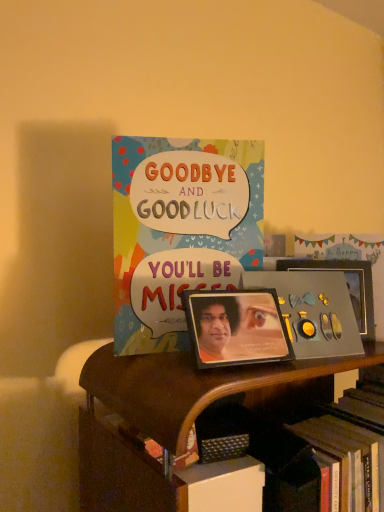
What is the approximate height of metallic silver picture frame at center-right, marked as the 1th picture frame in a right-to-left arrangement?

The height of metallic silver picture frame at center-right, marked as the 1th picture frame in a right-to-left arrangement, is 5.42 inches.

Where is `metallic silver picture frame at center-right, which is the 2th picture frame from left to right`? This screenshot has width=384, height=512. metallic silver picture frame at center-right, which is the 2th picture frame from left to right is located at coordinates (347, 285).

Where is `metallic photo frame at center, the 2th picture frame when ordered from back to front`? The image size is (384, 512). metallic photo frame at center, the 2th picture frame when ordered from back to front is located at coordinates (236, 327).

This screenshot has height=512, width=384. What do you see at coordinates (180, 230) in the screenshot? I see `colorful paper card at upper center` at bounding box center [180, 230].

What are the coordinates of `wooden bookcase at center` in the screenshot? It's located at (190, 386).

From the image's perspective, is metallic silver picture frame at center-right, the first picture frame viewed from the back, below colorful paper card at upper center?

Yes, from the image's perspective, metallic silver picture frame at center-right, the first picture frame viewed from the back, is below colorful paper card at upper center.

Which object is thinner, metallic silver picture frame at center-right, which is the 2th picture frame from left to right, or colorful paper card at upper center?

metallic silver picture frame at center-right, which is the 2th picture frame from left to right.

Is metallic silver picture frame at center-right, the second picture frame positioned from the front, not close to colorful paper card at upper center?

No, there isn't a large distance between metallic silver picture frame at center-right, the second picture frame positioned from the front, and colorful paper card at upper center.

Based on the photo, from a real-world perspective, does colorful paper card at upper center sit lower than wooden bookcase at center?

No, from a real-world perspective, colorful paper card at upper center is not below wooden bookcase at center.

The width and height of the screenshot is (384, 512). In the image, there is a colorful paper card at upper center. In order to click on bookcase below it (from a real-world perspective) in this screenshot , I will do `click(190, 386)`.

From the image's perspective, would you say colorful paper card at upper center is shown under wooden bookcase at center?

No, from the image's perspective, colorful paper card at upper center is not beneath wooden bookcase at center.

From the picture: Considering the sizes of objects metallic silver album cover at center and metallic photo frame at center, the second picture frame in the right-to-left sequence, in the image provided, who is wider, metallic silver album cover at center or metallic photo frame at center, the second picture frame in the right-to-left sequence,?

metallic photo frame at center, the second picture frame in the right-to-left sequence, is wider.

In the image, is metallic silver album cover at center on the left side or the right side of metallic photo frame at center, arranged as the first picture frame when viewed from the left?

From the image, it's evident that metallic silver album cover at center is to the right of metallic photo frame at center, arranged as the first picture frame when viewed from the left.

The width and height of the screenshot is (384, 512). Find the location of `album cover above the metallic photo frame at center, the 2th picture frame when ordered from back to front (from the image's perspective)`. album cover above the metallic photo frame at center, the 2th picture frame when ordered from back to front (from the image's perspective) is located at coordinates (313, 311).

Could you measure the distance between metallic silver album cover at center and metallic photo frame at center, which is the 1th picture frame in front-to-back order?

2.41 inches.

Does colorful paper card at upper center have a lesser height compared to metallic silver album cover at center?

Incorrect, the height of colorful paper card at upper center does not fall short of that of metallic silver album cover at center.

Does colorful paper card at upper center have a larger size compared to metallic silver album cover at center?

Correct, colorful paper card at upper center is larger in size than metallic silver album cover at center.

Is colorful paper card at upper center in contact with metallic silver album cover at center?

No, colorful paper card at upper center is not touching metallic silver album cover at center.

From a real-world perspective, is colorful paper card at upper center positioned above or below metallic photo frame at center, the second picture frame in the right-to-left sequence?

In terms of real-world spatial position, colorful paper card at upper center is above metallic photo frame at center, the second picture frame in the right-to-left sequence.

From the image's perspective, is colorful paper card at upper center below metallic photo frame at center, which is the 1th picture frame in front-to-back order?

No, from the image's perspective, colorful paper card at upper center is not below metallic photo frame at center, which is the 1th picture frame in front-to-back order.

In terms of width, does colorful paper card at upper center look wider or thinner when compared to metallic photo frame at center, which is the 1th picture frame in front-to-back order?

In the image, colorful paper card at upper center appears to be more narrow than metallic photo frame at center, which is the 1th picture frame in front-to-back order.

Is colorful paper card at upper center positioned with its back to metallic photo frame at center, the 2th picture frame when ordered from back to front?

That's right, colorful paper card at upper center is facing away from metallic photo frame at center, the 2th picture frame when ordered from back to front.

From the picture: Which point is more distant from viewer, (267,356) or (208,219)?

The point (208,219) is behind.

Is metallic photo frame at center, arranged as the first picture frame when viewed from the left, completely or partially outside of colorful paper card at upper center?

Yes.

From a real-world perspective, is metallic photo frame at center, arranged as the first picture frame when viewed from the left, located beneath colorful paper card at upper center?

Yes, from a real-world perspective, metallic photo frame at center, arranged as the first picture frame when viewed from the left, is under colorful paper card at upper center.

From the image's perspective, who appears lower, metallic photo frame at center, arranged as the first picture frame when viewed from the left, or colorful paper card at upper center?

From the image's view, metallic photo frame at center, arranged as the first picture frame when viewed from the left, is below.

Can we say metallic silver picture frame at center-right, the first picture frame viewed from the back, lies outside metallic silver album cover at center?

Indeed, metallic silver picture frame at center-right, the first picture frame viewed from the back, is completely outside metallic silver album cover at center.

How many degrees apart are the facing directions of metallic silver picture frame at center-right, the first picture frame viewed from the back, and metallic silver album cover at center?

13 degrees separate the facing orientations of metallic silver picture frame at center-right, the first picture frame viewed from the back, and metallic silver album cover at center.

Which is less distant, (362,306) or (324,284)?

Point (362,306) is farther from the camera than point (324,284).

From a real-world perspective, which object rests below the other?

metallic silver album cover at center is physically lower.

Locate an element on the screen. This screenshot has height=512, width=384. the 1st picture frame positioned below the colorful paper card at upper center (from the image's perspective) is located at coordinates (347, 285).

The image size is (384, 512). Find the location of `book behind the wooden bookcase at center`. book behind the wooden bookcase at center is located at coordinates (180, 230).

When comparing their distances from colorful paper card at upper center, does metallic photo frame at center, arranged as the first picture frame when viewed from the left, or metallic silver picture frame at center-right, the second picture frame positioned from the front, seem closer?

metallic photo frame at center, arranged as the first picture frame when viewed from the left, is closer to colorful paper card at upper center.

Considering their positions, is metallic photo frame at center, the 2th picture frame when ordered from back to front, positioned further to metallic silver album cover at center than metallic silver picture frame at center-right, the first picture frame viewed from the back?

Among the two, metallic silver picture frame at center-right, the first picture frame viewed from the back, is located further to metallic silver album cover at center.

Looking at the image, which one is located closer to metallic silver album cover at center, colorful paper card at upper center or metallic photo frame at center, the second picture frame in the right-to-left sequence?

Among the two, metallic photo frame at center, the second picture frame in the right-to-left sequence, is located nearer to metallic silver album cover at center.

Based on their spatial positions, is colorful paper card at upper center or wooden bookcase at center further from metallic photo frame at center, the 2th picture frame when ordered from back to front?

The object further to metallic photo frame at center, the 2th picture frame when ordered from back to front, is colorful paper card at upper center.

From the image, which object appears to be farther from metallic photo frame at center, arranged as the first picture frame when viewed from the left, metallic silver album cover at center or colorful paper card at upper center?

colorful paper card at upper center lies further to metallic photo frame at center, arranged as the first picture frame when viewed from the left, than the other object.

Estimate the real-world distances between objects in this image. Which object is closer to colorful paper card at upper center, wooden bookcase at center or metallic silver album cover at center?

metallic silver album cover at center lies closer to colorful paper card at upper center than the other object.

Looking at the image, which one is located further to metallic silver picture frame at center-right, the second picture frame positioned from the front, metallic silver album cover at center or wooden bookcase at center?

Among the two, wooden bookcase at center is located further to metallic silver picture frame at center-right, the second picture frame positioned from the front.

Based on their spatial positions, is metallic silver picture frame at center-right, the first picture frame viewed from the back, or metallic silver album cover at center closer to colorful paper card at upper center?

Based on the image, metallic silver album cover at center appears to be nearer to colorful paper card at upper center.

At what (x,y) coordinates should I click in order to perform the action: click on picture frame that lies between metallic silver picture frame at center-right, which is the 2th picture frame from left to right, and wooden bookcase at center from top to bottom. Please return your answer as a coordinate pair (x, y). Looking at the image, I should click on (236, 327).

This screenshot has width=384, height=512. I want to click on picture frame between metallic silver album cover at center and wooden bookcase at center vertically, so click(236, 327).

Find the location of a particular element. album cover between metallic silver picture frame at center-right, marked as the 1th picture frame in a right-to-left arrangement, and wooden bookcase at center in the up-down direction is located at coordinates (313, 311).

The image size is (384, 512). In order to click on album cover between colorful paper card at upper center and wooden bookcase at center in the vertical direction in this screenshot , I will do `click(313, 311)`.